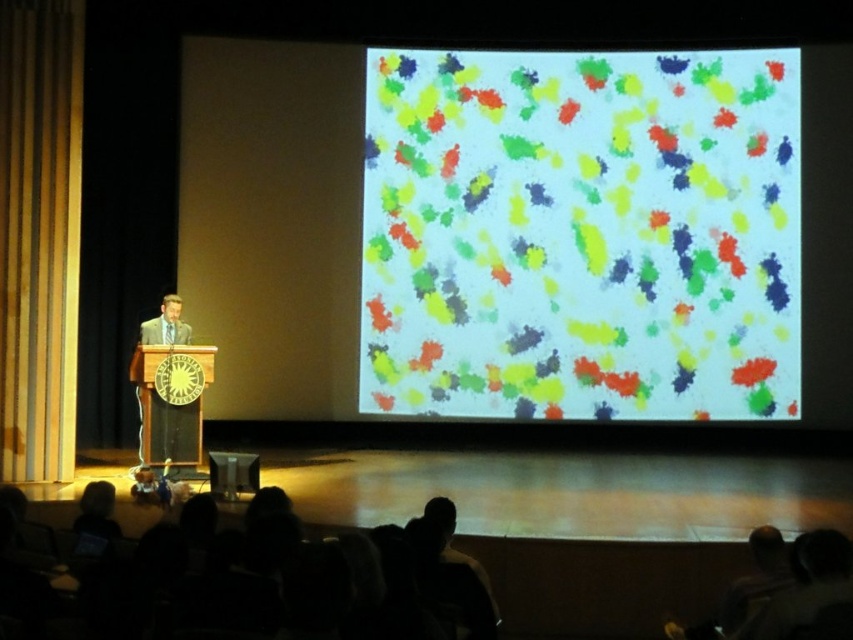
Is the position of colorful paint splatters at center less distant than that of dark hair at lower center?

No, it is not.

Which of these two, colorful paint splatters at center or dark hair at lower center, stands shorter?

Standing shorter between the two is dark hair at lower center.

Is point (776, 268) positioned before point (465, 598)?

No, (776, 268) is further to viewer.

This screenshot has width=853, height=640. What are the coordinates of `colorful paint splatters at center` in the screenshot? It's located at (581, 234).

Can you confirm if colorful paint splatters at center is shorter than wooden at left?

Correct, colorful paint splatters at center is not as tall as wooden at left.

Does colorful paint splatters at center have a greater width compared to wooden at left?

Yes, colorful paint splatters at center is wider than wooden at left.

Does point (393, 374) lie in front of point (22, 160)?

That is False.

What are the coordinates of `colorful paint splatters at center` in the screenshot? It's located at (581, 234).

Does dark hair at lower center have a lesser height compared to wooden at left?

Correct, dark hair at lower center is not as tall as wooden at left.

Is the position of dark hair at lower center less distant than that of wooden at left?

Yes, dark hair at lower center is in front of wooden at left.

Image resolution: width=853 pixels, height=640 pixels. What do you see at coordinates (276, 577) in the screenshot?
I see `dark hair at lower center` at bounding box center [276, 577].

The width and height of the screenshot is (853, 640). I want to click on dark hair at lower center, so click(x=276, y=577).